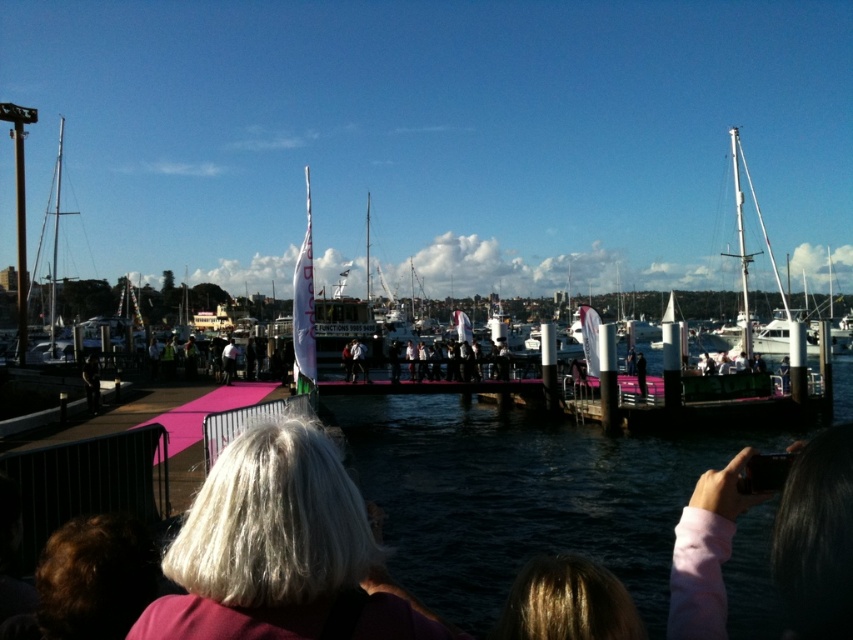
Is blonde hair at center bigger than dark gray fabric jacket at lower left?

Incorrect, blonde hair at center is not larger than dark gray fabric jacket at lower left.

Which is above, blonde hair at center or dark gray fabric jacket at lower left?

Positioned higher is dark gray fabric jacket at lower left.

Is point (303, 429) farther from camera compared to point (93, 362)?

No.

You are a GUI agent. You are given a task and a screenshot of the screen. Output one action in this format:
    pyautogui.click(x=<x>, y=<y>)
    Task: Click on the blonde hair at center
    
    Given the screenshot: What is the action you would take?
    pyautogui.click(x=277, y=548)

Can you confirm if blonde hair at center is positioned to the right of white glossy sailboat at right?

Incorrect, blonde hair at center is not on the right side of white glossy sailboat at right.

The image size is (853, 640). I want to click on blonde hair at center, so click(277, 548).

Between pink fabric at lower right and dark gray fabric jacket at lower left, which one has less height?

dark gray fabric jacket at lower left

Does pink fabric at lower right have a larger size compared to dark gray fabric jacket at lower left?

Yes.

Who is more distant from viewer, (846, 593) or (96, 392)?

Positioned behind is point (96, 392).

What are the coordinates of `pink fabric at lower right` in the screenshot? It's located at (816, 538).